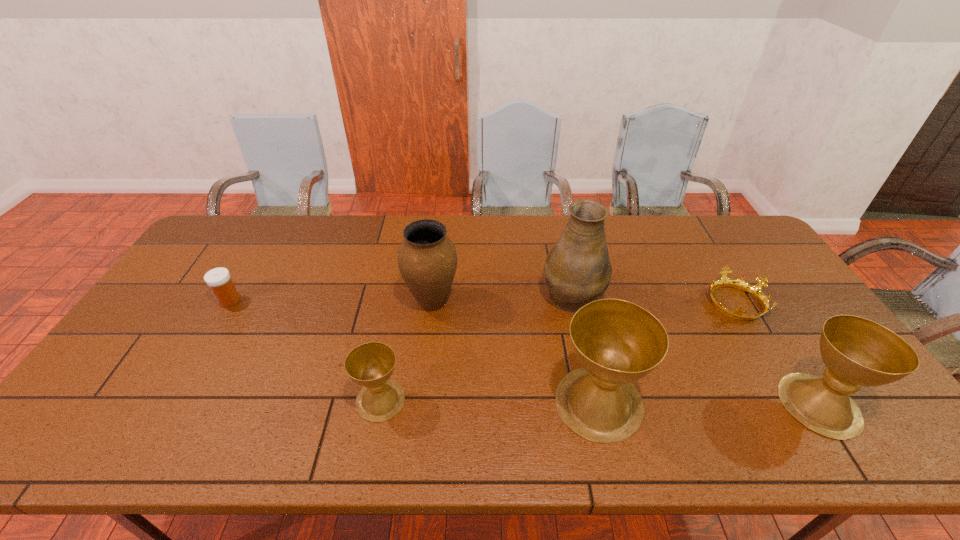
Locate an element on the screen. Image resolution: width=960 pixels, height=540 pixels. blank space that satisfies the following two spatial constraints: 1. on the front side of the rightmost chalice; 2. on the left side of the second chalice from left to right is located at coordinates (599, 404).

The height and width of the screenshot is (540, 960). I want to click on vacant region that satisfies the following two spatial constraints: 1. on the front side of the rightmost chalice; 2. on the left side of the shortest object, so click(x=796, y=404).